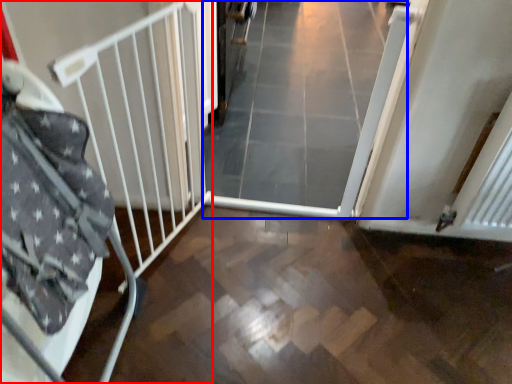
Question: Which object appears closest to the camera in this image, bed frame (highlighted by a red box) or plain (highlighted by a blue box)?

Choices:
 (A) bed frame
 (B) plain

Answer: (A)